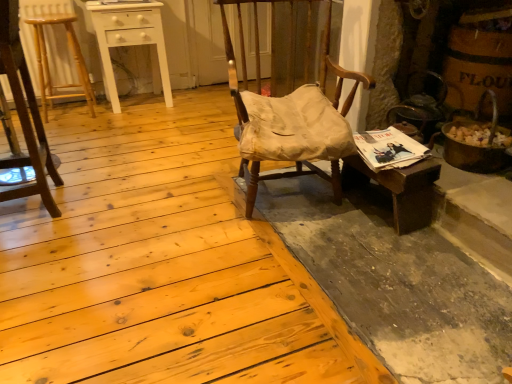
The height and width of the screenshot is (384, 512). I want to click on free space that is in between wooden stool at left, which is the 2th chair in right-to-left order, and wooden chair with worn fabric cushion at center, the second chair positioned from the left, so click(x=143, y=201).